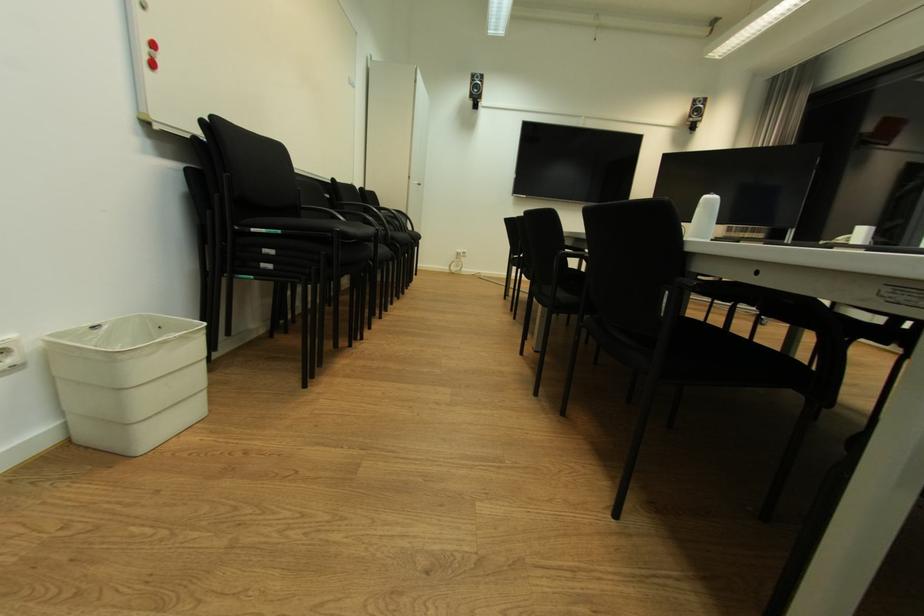
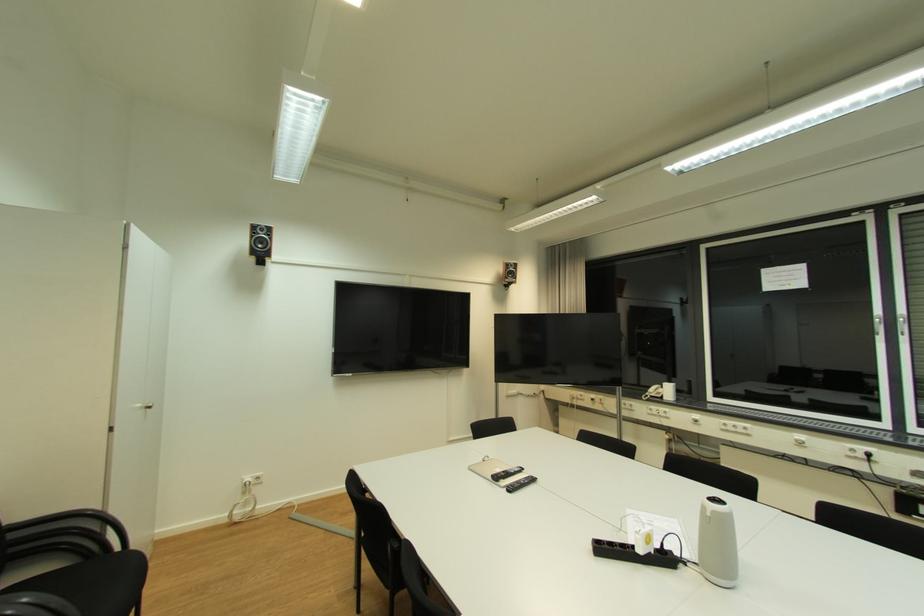
Find the pixel in the second image that matches (478,77) in the first image.

(261, 228)